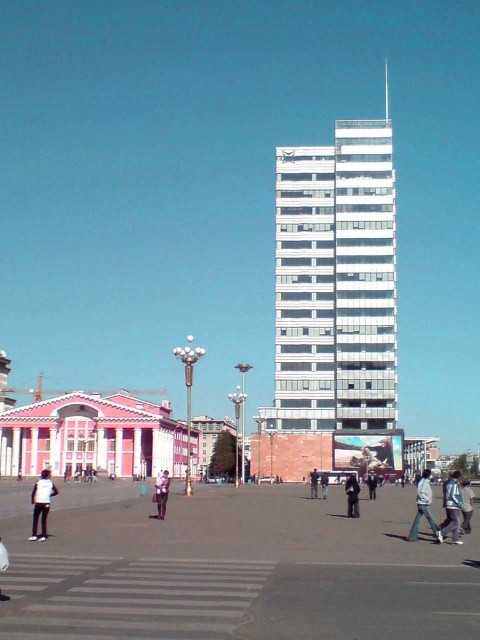
Measure the distance between point (446,483) and camera.

Point (446,483) and camera are 50.50 meters apart from each other.

Between point (450, 476) and point (358, 512), which one is positioned behind?

The point (450, 476) is more distant.

Who is more forward, (447, 508) or (357, 484)?

Point (447, 508) is more forward.

The image size is (480, 640). Identify the location of blue denim jacket at lower right. (451, 508).

This screenshot has height=640, width=480. What do you see at coordinates (41, 502) in the screenshot? I see `white matte jacket at lower left` at bounding box center [41, 502].

Does white matte jacket at lower left come behind blue denim jacket at lower right?

No, white matte jacket at lower left is closer to the viewer.

Who is more forward, (44, 532) or (443, 486)?

Point (44, 532) is more forward.

Identify the location of white matte jacket at lower left. The image size is (480, 640). (41, 502).

Which is above, blue denim jacket at lower right or blue denim jeans at lower right?

blue denim jeans at lower right

Which is more to the left, blue denim jacket at lower right or blue denim jeans at lower right?

Positioned to the left is blue denim jeans at lower right.

Between point (450, 483) and point (463, 506), which one is positioned in front?

Point (463, 506) is in front.

I want to click on blue denim jacket at lower right, so click(451, 508).